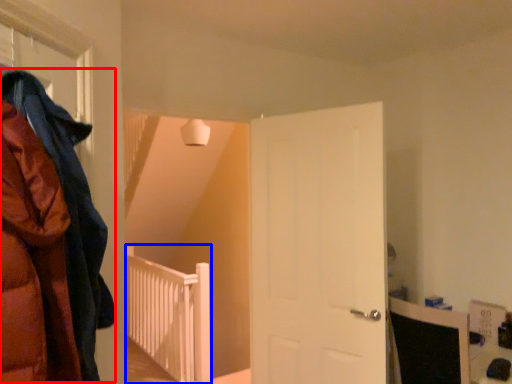
Question: Which of the following is the farthest to the observer, cloak (highlighted by a red box) or rail (highlighted by a blue box)?

Choices:
 (A) cloak
 (B) rail

Answer: (B)